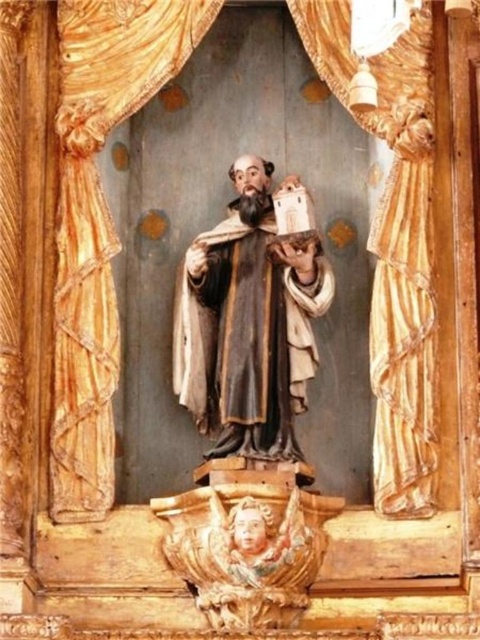
Question: Is gold textured curtain at center below matte brown robe at center?

Choices:
 (A) yes
 (B) no

Answer: (B)

Question: Does wooden at left have a lesser width compared to matte brown robe at center?

Choices:
 (A) no
 (B) yes

Answer: (A)

Question: Among these points, which one is nearest to the camera?

Choices:
 (A) (212, 618)
 (B) (397, 385)
 (C) (172, 328)
 (D) (56, 291)

Answer: (A)

Question: Which of these objects is positioned closest to the matte brown robe at center?

Choices:
 (A) carved wood cherub at lower center
 (B) wooden at left

Answer: (B)

Question: Is gold textured curtain at center bigger than carved wood cherub at lower center?

Choices:
 (A) yes
 (B) no

Answer: (A)

Question: Which of the following is the closest to the observer?

Choices:
 (A) carved wood cherub at lower center
 (B) wooden at left
 (C) gold textured curtain at center
 (D) matte brown robe at center

Answer: (A)